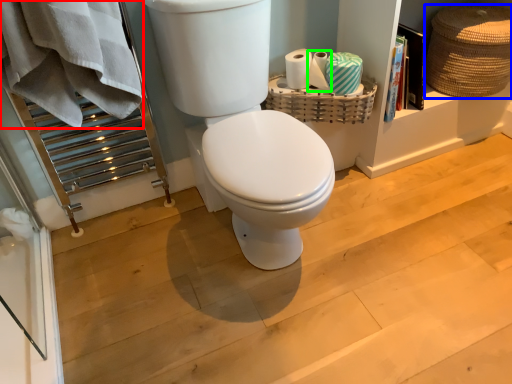
Question: Which is farther away from bath towel (highlighted by a red box)? basket (highlighted by a blue box) or toilet paper (highlighted by a green box)?

Choices:
 (A) basket
 (B) toilet paper

Answer: (A)